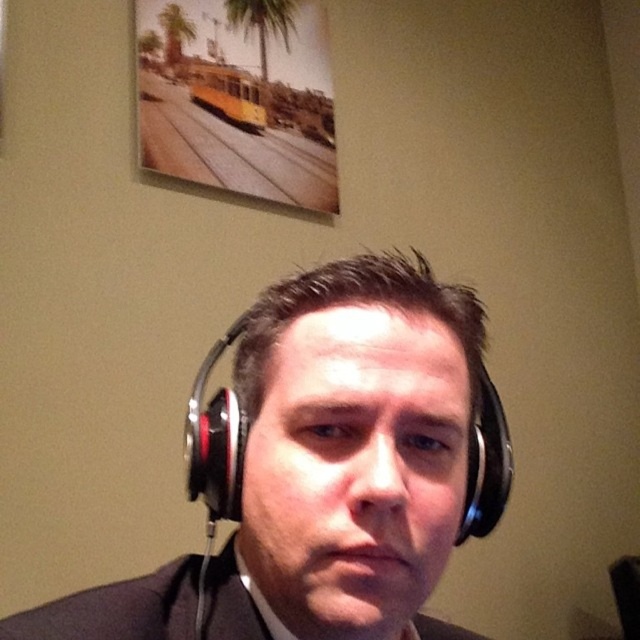
Which is above, black matte business suit at lower center or black matte headphones at center?

black matte headphones at center is above.

Which is behind, point (112, 592) or point (204, 458)?

Positioned behind is point (112, 592).

Where is `black matte business suit at lower center`? The width and height of the screenshot is (640, 640). black matte business suit at lower center is located at coordinates (116, 609).